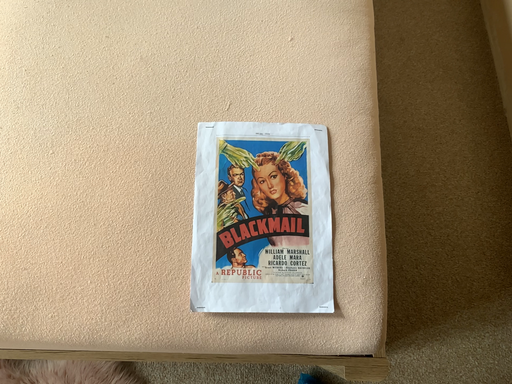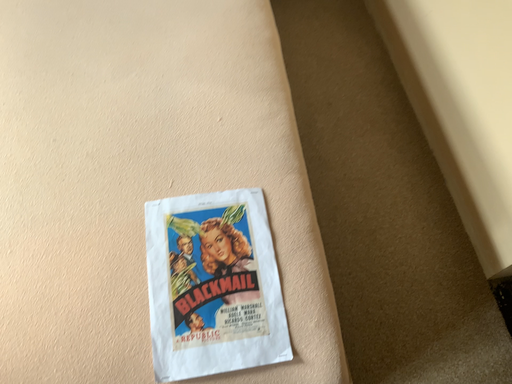
Question: How did the camera likely rotate when shooting the video?

Choices:
 (A) rotated upward
 (B) rotated downward

Answer: (A)